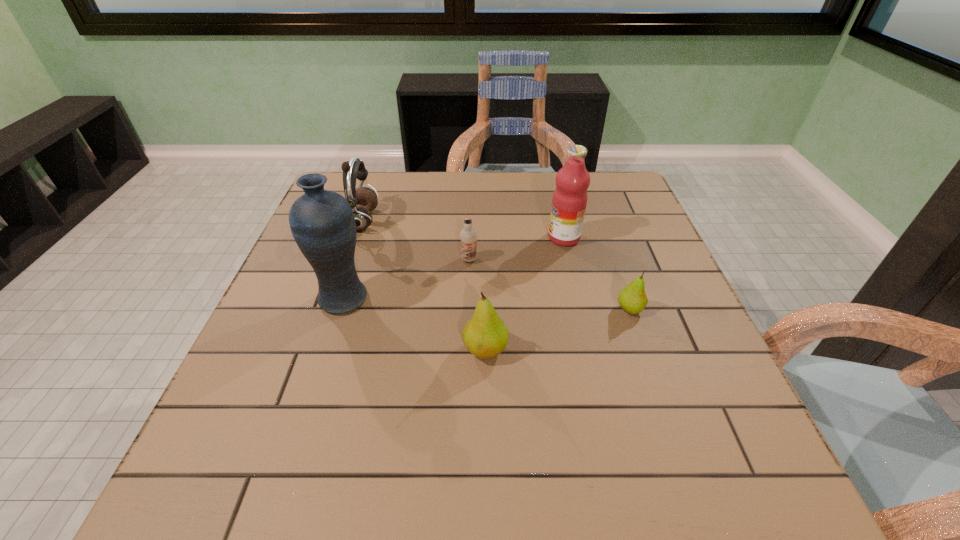
This screenshot has width=960, height=540. In order to click on the nearest object in this screenshot , I will do `click(485, 335)`.

The width and height of the screenshot is (960, 540). I want to click on the nearer pear, so click(x=485, y=335).

Where is `the right pear`? the right pear is located at coordinates (632, 298).

At what (x,y) coordinates should I click in order to perform the action: click on the shorter pear. Please return your answer as a coordinate pair (x, y). The image size is (960, 540). Looking at the image, I should click on (632, 298).

Locate an element on the screen. earphone is located at coordinates (362, 200).

You are a GUI agent. You are given a task and a screenshot of the screen. Output one action in this format:
    pyautogui.click(x=<x>, y=<y>)
    Task: Click on the fifth shortest object
    Image resolution: width=960 pixels, height=540 pixels.
    Given the screenshot: What is the action you would take?
    pyautogui.click(x=569, y=201)

Identify the location of the second object from right to left. (569, 201).

You are a GUI agent. You are given a task and a screenshot of the screen. Output one action in this format:
    pyautogui.click(x=<x>, y=<y>)
    Task: Click on the fourth nearest object
    
    Given the screenshot: What is the action you would take?
    pyautogui.click(x=468, y=236)

Find the location of `vase`. vase is located at coordinates (322, 222).

Where is `vacant region located 0.070m on the front of the left pear`? The width and height of the screenshot is (960, 540). vacant region located 0.070m on the front of the left pear is located at coordinates (486, 399).